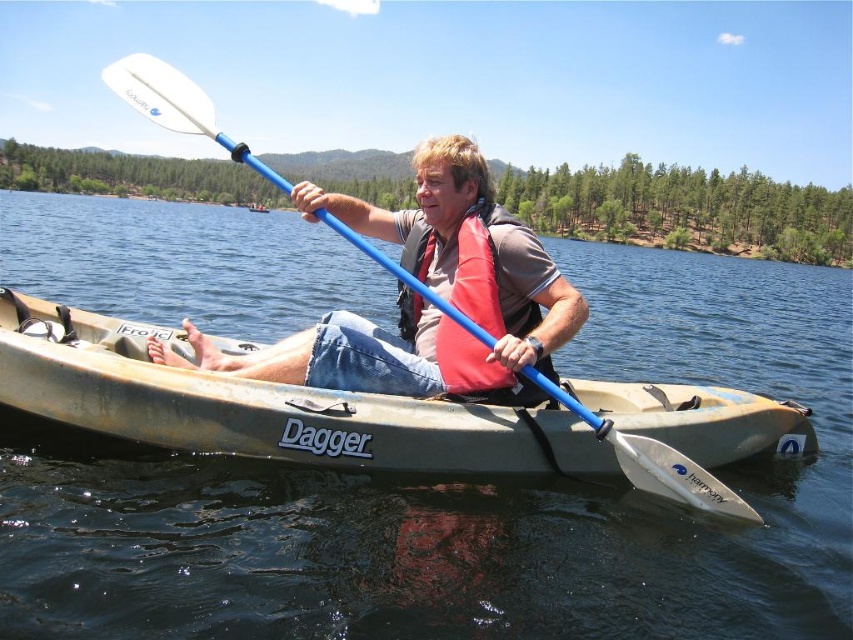
Question: Can you confirm if clear blue water at center is positioned above matte blue kayak at center?

Choices:
 (A) no
 (B) yes

Answer: (B)

Question: Among these points, which one is nearest to the camera?

Choices:
 (A) (532, 326)
 (B) (695, 620)
 (C) (454, 291)
 (D) (688, 460)

Answer: (B)

Question: Is matte blue kayak at center positioned behind white plastic paddle at center?

Choices:
 (A) no
 (B) yes

Answer: (B)

Question: Estimate the real-world distances between objects in this image. Which object is closer to the matte blue kayak at center?

Choices:
 (A) clear blue water at center
 (B) red matte life jacket at center

Answer: (B)

Question: Does matte blue kayak at center have a larger size compared to red matte life jacket at center?

Choices:
 (A) no
 (B) yes

Answer: (A)

Question: Which of the following is the farthest from the observer?

Choices:
 (A) (759, 490)
 (B) (416, 161)
 (C) (434, 349)

Answer: (A)